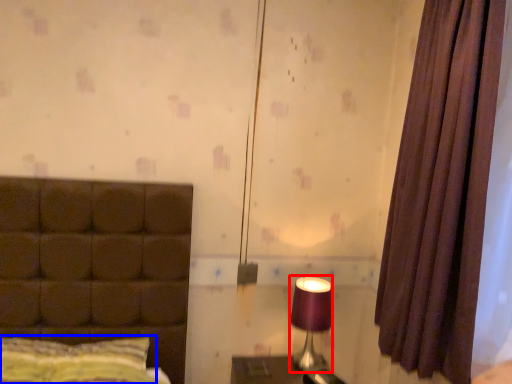
Question: Among these objects, which one is nearest to the camera, table lamp (highlighted by a red box) or pillow (highlighted by a blue box)?

Choices:
 (A) table lamp
 (B) pillow

Answer: (B)